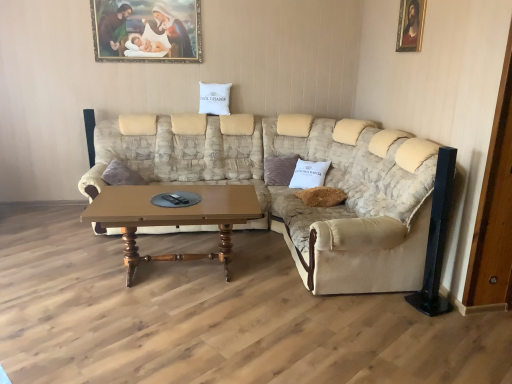
Find the location of a particular element. The image size is (512, 384). blank space situated above wooden polished coffee table at center (from a real-world perspective) is located at coordinates (201, 201).